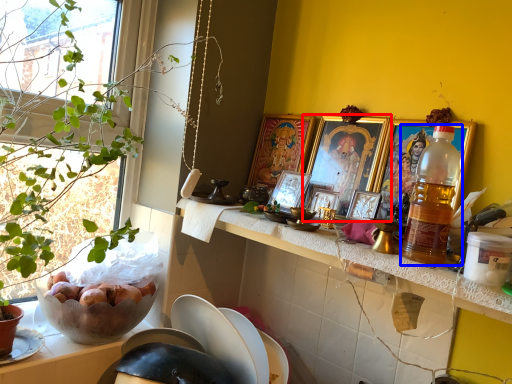
Question: Which point is further to the camera, picture frame (highlighted by a red box) or bottle (highlighted by a blue box)?

Choices:
 (A) picture frame
 (B) bottle

Answer: (A)